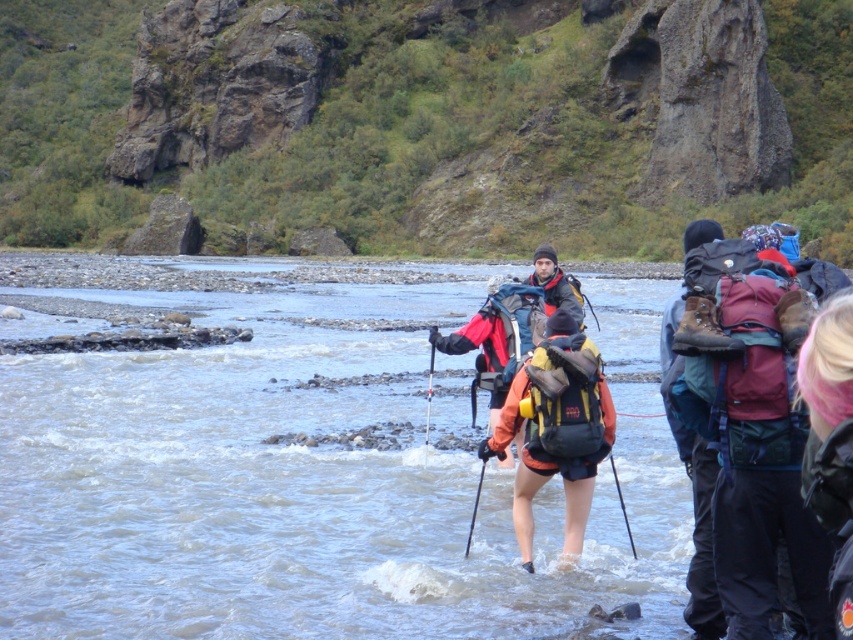
Who is positioned more to the right, orange fabric backpack at center or pink hair at lower right?

pink hair at lower right is more to the right.

Is orange fabric backpack at center positioned in front of pink hair at lower right?

That is False.

Locate an element on the screen. The width and height of the screenshot is (853, 640). orange fabric backpack at center is located at coordinates (556, 428).